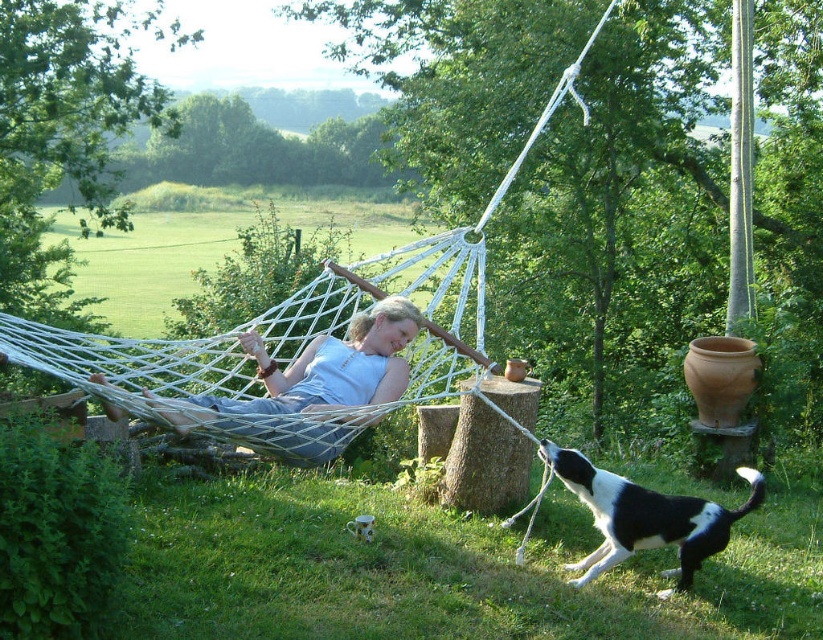
You are a photographer trying to capture the white cotton hammock at center and the black and white fur dog at lower right in the same frame. Based on their positions, which object should you focus on first to ensure both are in focus?

The white cotton hammock at center is in front of the black and white fur dog at lower right, so you should focus on the white cotton hammock at center first to ensure both are in focus.

You are standing at the origin of the coordinate system in this image. You want to walk towards the point at the lower right corner. Which point, point at (414,248) or point at (205,401), is closer to your path?

Point at (205,401) is closer to your path because it is located at a lower y coordinate and closer to the lower right corner than point at (414,248).

You are standing at the origin point in the image. There are two points marked in the scene. Which point is closer to you, point (374, 316) or point (589, 500)?

Point (589, 500) is closer to you because it is in front of point (374, 316).